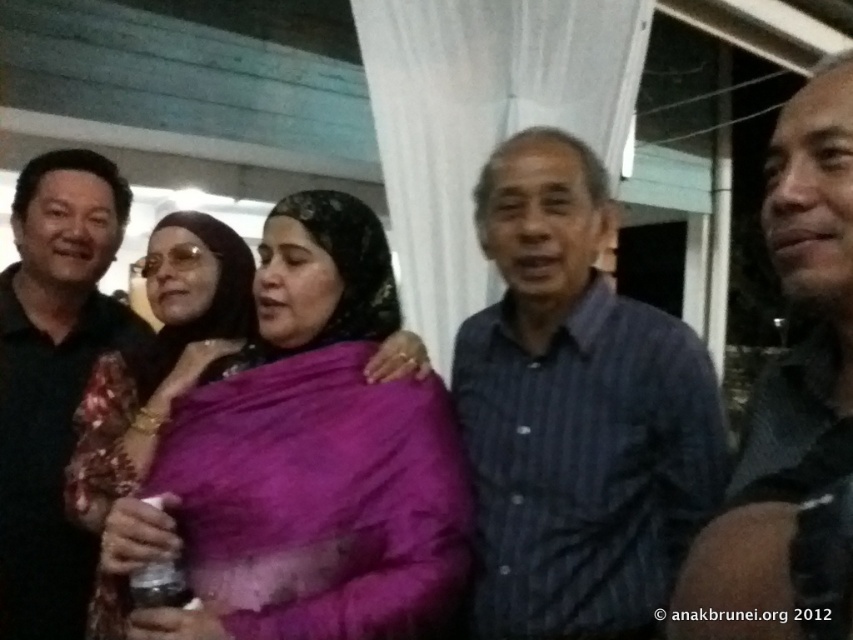
You are a photographer reviewing the image. You notice two men in the group wearing distinct shirts. The blue striped shirt at center and the black matte shirt at left. Based on their positions in the image, which shirt is closer to the right edge of the photo?

The blue striped shirt at center is to the right of the black matte shirt at left, so the blue striped shirt at center is closer to the right edge of the photo.

You are a photographer trying to adjust the lighting for a group photo. You notice the blue striped shirt at center and the purple silk saree at center. Which one is positioned higher in the frame?

The blue striped shirt at center is positioned higher in the frame than the purple silk saree at center.